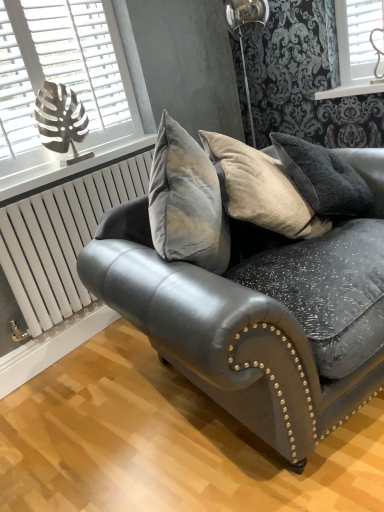
Question: In terms of width, does metallic silver leaf at upper left look wider or thinner when compared to velvet grey couch at center?

Choices:
 (A) wide
 (B) thin

Answer: (B)

Question: From a real-world perspective, is metallic silver leaf at upper left physically located above or below velvet grey couch at center?

Choices:
 (A) above
 (B) below

Answer: (A)

Question: Which object is the farthest from the white painted wood at upper center?

Choices:
 (A) white metallic radiator at lower left
 (B) metallic leaf-shaped object at upper left
 (C) metallic silver leaf at upper left
 (D) velvet grey couch at center

Answer: (A)

Question: Considering the real-world distances, which object is closest to the white painted wood at upper center?

Choices:
 (A) metallic leaf-shaped object at upper left
 (B) white metallic radiator at lower left
 (C) velvet grey couch at center
 (D) metallic silver leaf at upper left

Answer: (D)